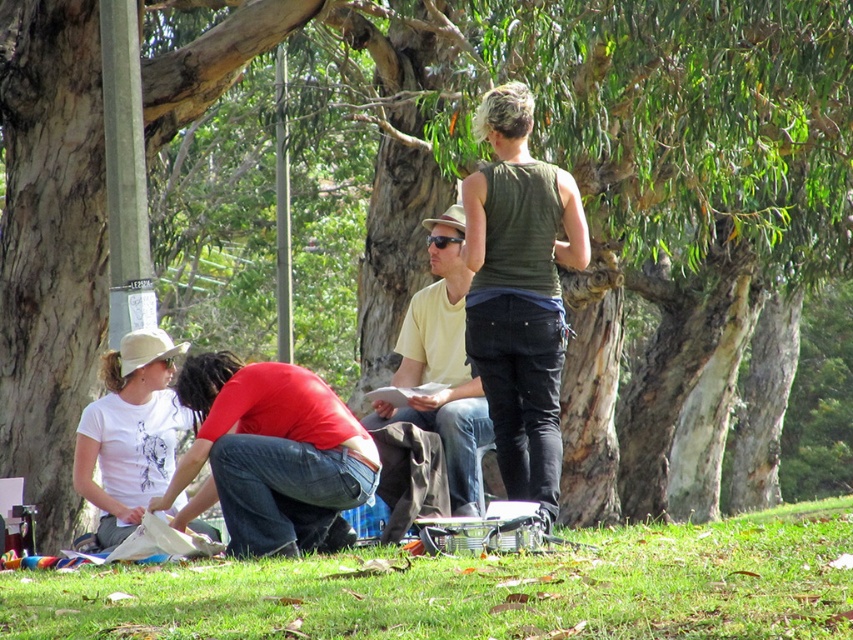
You are standing at the camera position and want to reach both the point at coordinates (373, 465) and the point at coordinates (85, 497) in the scene. Which point will you reach first as you move forward?

You will reach point (373, 465) first because it is closer to the camera than point (85, 497).